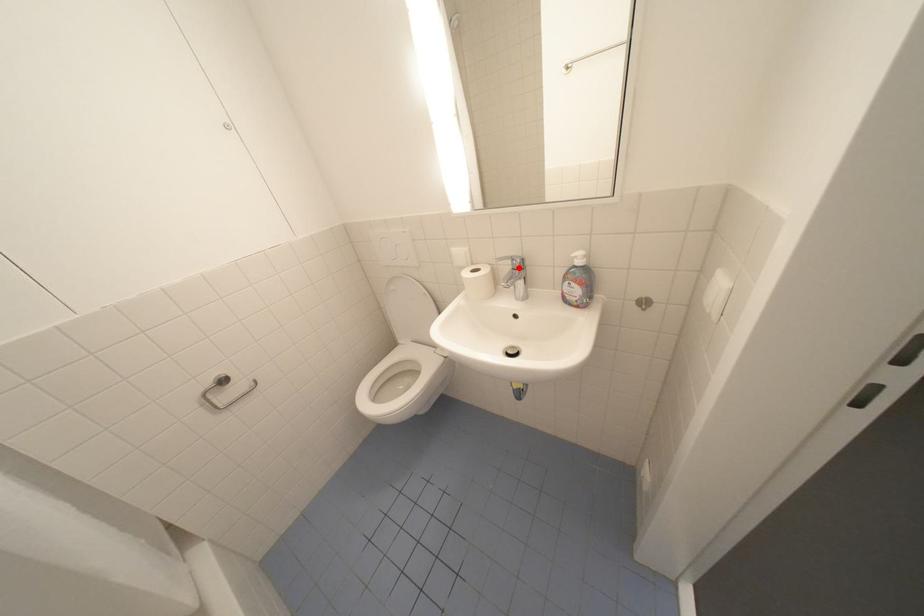
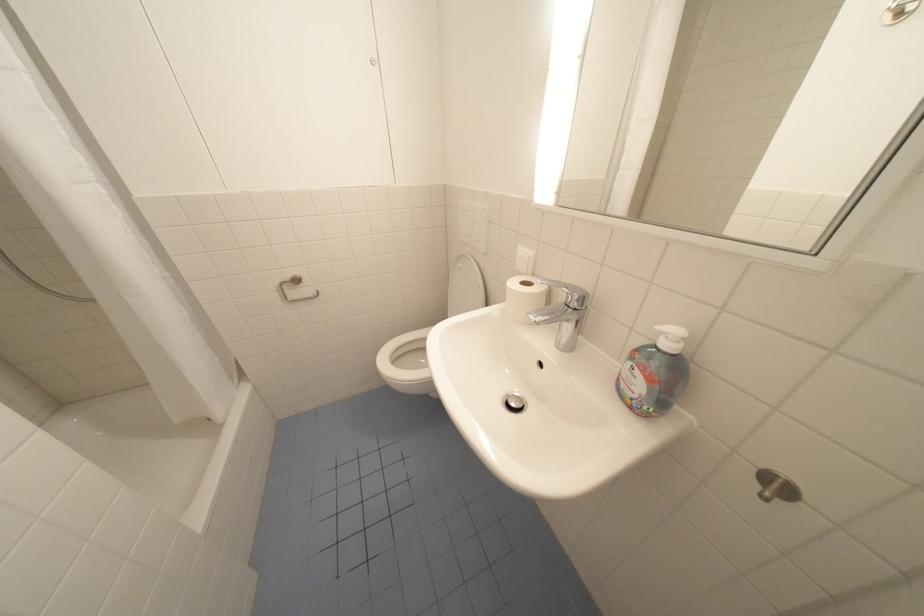
Find the pixel in the second image that matches the highlighted location in the first image.

(572, 301)